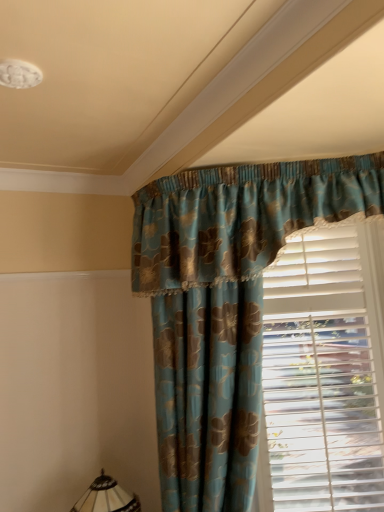
Question: Is translucent glass lampshade at lower left inside the boundaries of white plastic blinds at right, or outside?

Choices:
 (A) outside
 (B) inside

Answer: (A)

Question: Based on their positions, is translucent glass lampshade at lower left located to the left or right of white plastic blinds at right?

Choices:
 (A) right
 (B) left

Answer: (B)

Question: Estimate the real-world distances between objects in this image. Which object is closer to the translucent glass lampshade at lower left?

Choices:
 (A) white plastic blinds at right
 (B) blue floral fabric curtain at center

Answer: (B)

Question: Which of these objects is positioned farthest from the blue floral fabric curtain at center?

Choices:
 (A) translucent glass lampshade at lower left
 (B) white plastic blinds at right

Answer: (A)